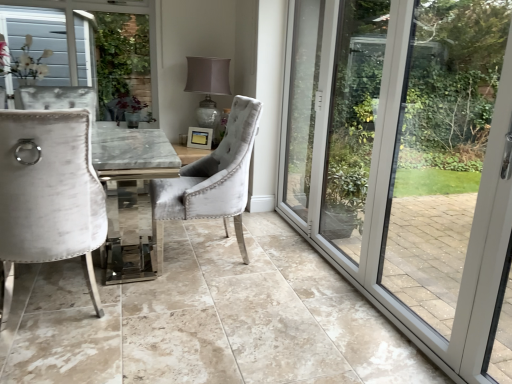
Where is `vacant area situated below transparent glass door at right (from a real-world perspective)`? This screenshot has height=384, width=512. vacant area situated below transparent glass door at right (from a real-world perspective) is located at coordinates (339, 275).